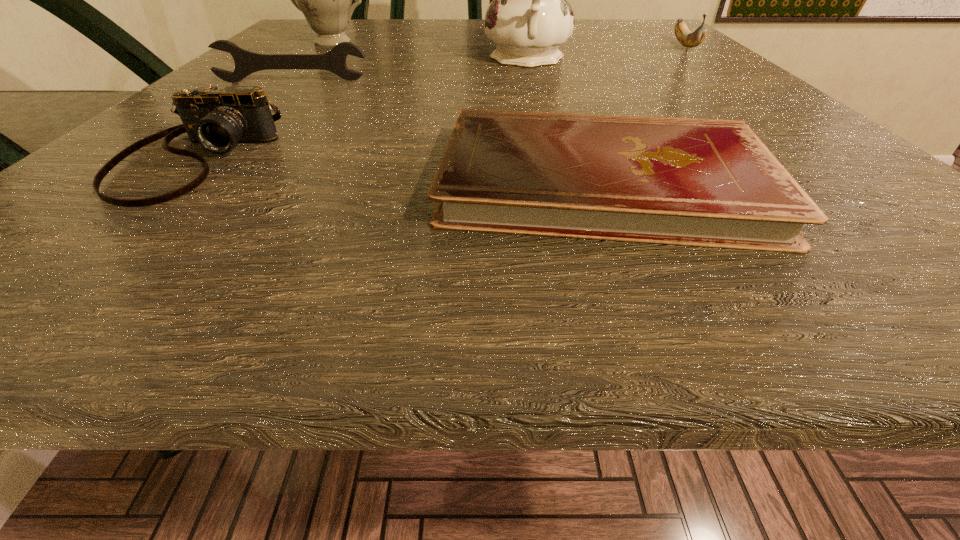
You are a GUI agent. You are given a task and a screenshot of the screen. Output one action in this format:
    pyautogui.click(x=<x>, y=<y>)
    Task: Click on the vacant space located at the stem of the banana
    Image resolution: width=960 pixels, height=540 pixels.
    Given the screenshot: What is the action you would take?
    pyautogui.click(x=749, y=93)

Locate an element on the screen. The width and height of the screenshot is (960, 540). vacant space located on the open ends of the wrench is located at coordinates (186, 189).

Image resolution: width=960 pixels, height=540 pixels. I want to click on free space located 0.310m on the back of the shortest object, so click(x=551, y=60).

Where is `banana positioned at the far edge`? The height and width of the screenshot is (540, 960). banana positioned at the far edge is located at coordinates (689, 39).

The image size is (960, 540). I want to click on object that is at the near edge, so tap(713, 183).

You are a GUI agent. You are given a task and a screenshot of the screen. Output one action in this format:
    pyautogui.click(x=<x>, y=<y>)
    Task: Click on the chinaware positioned at the left edge
    
    Given the screenshot: What is the action you would take?
    pyautogui.click(x=325, y=0)

Locate an element on the screen. Image resolution: width=960 pixels, height=540 pixels. wrench situated at the left edge is located at coordinates (246, 62).

Locate an element on the screen. camera present at the left edge is located at coordinates (217, 119).

Identify the location of banana positioned at the right edge. (689, 39).

The width and height of the screenshot is (960, 540). Identify the location of notebook located at the right edge. (713, 183).